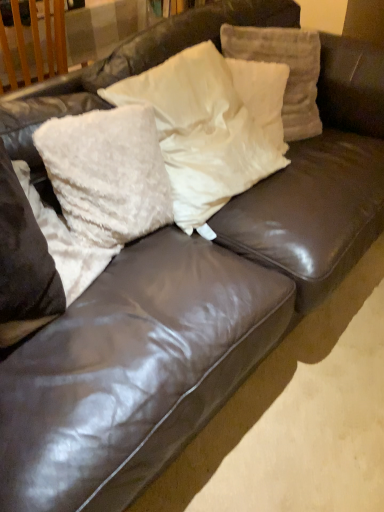
Question: In which direction should I rotate to look at white fluffy pillow at center, marked as the 4th pillow in a right-to-left arrangement?

Choices:
 (A) left
 (B) right

Answer: (A)

Question: Which direction should I rotate to face white fluffy pillow at upper center, which is the fifth pillow in left-to-right order, — up or down?

Choices:
 (A) down
 (B) up

Answer: (B)

Question: Is white fluffy pillow at left, which is the first pillow from left to right, positioned behind white fluffy pillow at upper center, which is the fifth pillow in left-to-right order?

Choices:
 (A) yes
 (B) no

Answer: (B)

Question: Is white fluffy pillow at left, which is the first pillow from left to right, thinner than white fluffy pillow at upper center, the 1th pillow positioned from the right?

Choices:
 (A) yes
 (B) no

Answer: (B)

Question: Does white fluffy pillow at left, which is the first pillow from left to right, contain white fluffy pillow at upper center, the 1th pillow positioned from the right?

Choices:
 (A) no
 (B) yes

Answer: (A)

Question: Is white fluffy pillow at left, arranged as the fifth pillow when viewed from the right, looking in the opposite direction of white fluffy pillow at upper center, the 1th pillow positioned from the right?

Choices:
 (A) yes
 (B) no

Answer: (B)

Question: Does white fluffy pillow at left, arranged as the fifth pillow when viewed from the right, have a lesser height compared to white fluffy pillow at upper center, which is the fifth pillow in left-to-right order?

Choices:
 (A) yes
 (B) no

Answer: (A)

Question: Is white fluffy pillow at left, arranged as the fifth pillow when viewed from the right, next to white fluffy pillow at upper center, the 1th pillow positioned from the right?

Choices:
 (A) yes
 (B) no

Answer: (B)

Question: From a real-world perspective, is white fluffy pillow at upper center, arranged as the 2th pillow when viewed from the right, beneath white fluffy pillow at upper center, the 1th pillow positioned from the right?

Choices:
 (A) no
 (B) yes

Answer: (B)

Question: Does white fluffy pillow at upper center, positioned as the fourth pillow in left-to-right order, have a greater width compared to white fluffy pillow at upper center, which is the fifth pillow in left-to-right order?

Choices:
 (A) yes
 (B) no

Answer: (B)

Question: Does white fluffy pillow at upper center, positioned as the fourth pillow in left-to-right order, contain white fluffy pillow at upper center, the 1th pillow positioned from the right?

Choices:
 (A) yes
 (B) no

Answer: (B)

Question: From a real-world perspective, is white fluffy pillow at upper center, positioned as the fourth pillow in left-to-right order, on top of white fluffy pillow at upper center, which is the fifth pillow in left-to-right order?

Choices:
 (A) no
 (B) yes

Answer: (A)

Question: Is white fluffy pillow at upper center, positioned as the fourth pillow in left-to-right order, completely or partially outside of white fluffy pillow at upper center, the 1th pillow positioned from the right?

Choices:
 (A) no
 (B) yes

Answer: (A)

Question: Is white fluffy pillow at upper center, positioned as the fourth pillow in left-to-right order, behind white fluffy pillow at upper center, the 1th pillow positioned from the right?

Choices:
 (A) yes
 (B) no

Answer: (A)

Question: From the image's perspective, is white fluffy pillow at left, which is the first pillow from left to right, over white fluffy pillow at center, marked as the 3th pillow in a right-to-left arrangement?

Choices:
 (A) yes
 (B) no

Answer: (B)